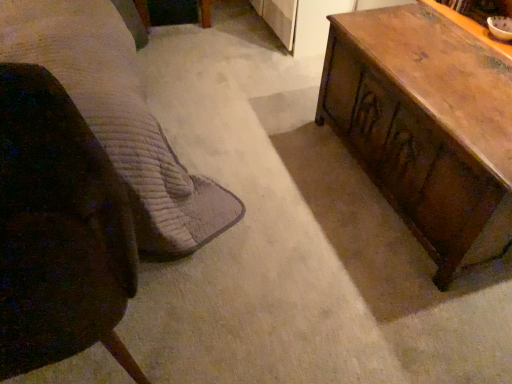
In the scene shown: Measure the distance between point (83, 290) and camera.

Point (83, 290) and camera are 38.07 inches apart.

Identify the location of brown quilted fabric bed at left. Image resolution: width=512 pixels, height=384 pixels. (119, 117).

Measure the distance between wooden trunk at right and camera.

The depth of wooden trunk at right is 1.15 meters.

Where is `dark brown leather chair at left`? Image resolution: width=512 pixels, height=384 pixels. dark brown leather chair at left is located at coordinates (58, 230).

Is wooden trunk at right situated inside dark brown leather chair at left or outside?

wooden trunk at right exists outside the volume of dark brown leather chair at left.

The image size is (512, 384). Identify the location of chair in front of the wooden trunk at right. (58, 230).

Which of these two, wooden trunk at right or dark brown leather chair at left, stands shorter?

wooden trunk at right is shorter.

Is brown quilted fabric bed at left facing towards dark brown leather chair at left?

Yes, brown quilted fabric bed at left faces towards dark brown leather chair at left.

Between brown quilted fabric bed at left and dark brown leather chair at left, which one has larger width?

With larger width is brown quilted fabric bed at left.

Is brown quilted fabric bed at left not near dark brown leather chair at left?

They are positioned close to each other.

Is wooden trunk at right wider or thinner than brown quilted fabric bed at left?

Considering their sizes, wooden trunk at right looks slimmer than brown quilted fabric bed at left.

Can we say wooden trunk at right lies outside brown quilted fabric bed at left?

That's correct, wooden trunk at right is outside of brown quilted fabric bed at left.

Between wooden trunk at right and brown quilted fabric bed at left, which one has more height?

Standing taller between the two is brown quilted fabric bed at left.

Is wooden trunk at right in front of or behind brown quilted fabric bed at left in the image?

Visually, wooden trunk at right is located behind brown quilted fabric bed at left.

Is dark brown leather chair at left in front of or behind brown quilted fabric bed at left in the image?

Visually, dark brown leather chair at left is located in front of brown quilted fabric bed at left.

Can you confirm if dark brown leather chair at left is positioned to the right of brown quilted fabric bed at left?

Indeed, dark brown leather chair at left is positioned on the right side of brown quilted fabric bed at left.

Could you tell me if dark brown leather chair at left is facing brown quilted fabric bed at left?

No, dark brown leather chair at left is not facing towards brown quilted fabric bed at left.

Is brown quilted fabric bed at left inside the boundaries of wooden trunk at right, or outside?

brown quilted fabric bed at left cannot be found inside wooden trunk at right.

Considering the points (216, 205) and (390, 70), which point is in front, point (216, 205) or point (390, 70)?

The point (390, 70) is in front.

Which of these two, brown quilted fabric bed at left or wooden trunk at right, stands shorter?

wooden trunk at right.

Considering the relative sizes of brown quilted fabric bed at left and wooden trunk at right in the image provided, is brown quilted fabric bed at left bigger than wooden trunk at right?

Indeed, brown quilted fabric bed at left has a larger size compared to wooden trunk at right.

From the image's perspective, relative to wooden trunk at right, is dark brown leather chair at left above or below?

dark brown leather chair at left is situated lower than wooden trunk at right in the image.

Is dark brown leather chair at left inside or outside of wooden trunk at right?

dark brown leather chair at left is outside wooden trunk at right.

Considering the relative positions of dark brown leather chair at left and wooden trunk at right in the image provided, is dark brown leather chair at left to the right of wooden trunk at right from the viewer's perspective?

No, dark brown leather chair at left is not to the right of wooden trunk at right.

Considering the positions of points (28, 263) and (507, 158), is point (28, 263) farther from camera compared to point (507, 158)?

No, it is in front of (507, 158).

Find the location of a particular element. The image size is (512, 384). table that is under the dark brown leather chair at left (from a real-world perspective) is located at coordinates (426, 127).

Find the location of a particular element. chair in front of the brown quilted fabric bed at left is located at coordinates (58, 230).

Based on their spatial positions, is brown quilted fabric bed at left or dark brown leather chair at left further from wooden trunk at right?

Among the two, dark brown leather chair at left is located further to wooden trunk at right.

Based on their spatial positions, is dark brown leather chair at left or wooden trunk at right further from brown quilted fabric bed at left?

Based on the image, wooden trunk at right appears to be further to brown quilted fabric bed at left.

In the scene shown: From the image, which object appears to be nearer to brown quilted fabric bed at left, wooden trunk at right or dark brown leather chair at left?

The object closer to brown quilted fabric bed at left is dark brown leather chair at left.

Looking at the image, which one is located closer to dark brown leather chair at left, wooden trunk at right or brown quilted fabric bed at left?

Among the two, brown quilted fabric bed at left is located nearer to dark brown leather chair at left.

Looking at the image, which one is located closer to dark brown leather chair at left, brown quilted fabric bed at left or wooden trunk at right?

brown quilted fabric bed at left.

Based on their spatial positions, is dark brown leather chair at left or brown quilted fabric bed at left further from wooden trunk at right?

Among the two, dark brown leather chair at left is located further to wooden trunk at right.

Locate an element on the screen. This screenshot has width=512, height=384. chair between brown quilted fabric bed at left and wooden trunk at right from left to right is located at coordinates (58, 230).